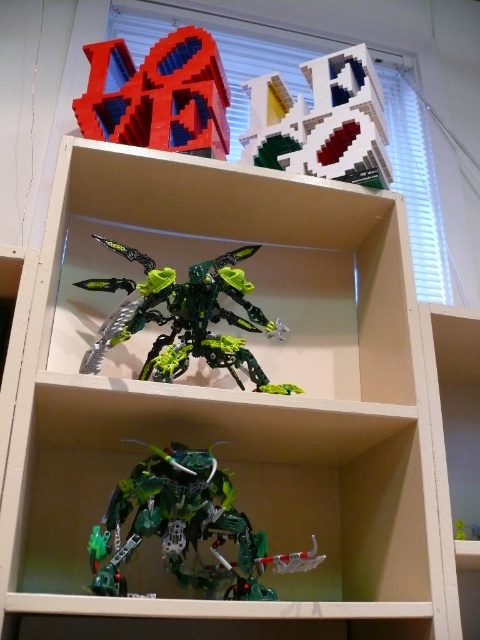
Question: Which of the following is the farthest from the observer?

Choices:
 (A) (180, 563)
 (B) (168, 115)

Answer: (B)

Question: Which point is closer to the camera taking this photo?

Choices:
 (A) (238, 314)
 (B) (374, 124)
 (C) (193, 572)
 (D) (181, 122)

Answer: (C)

Question: Can you confirm if translucent green plastic robot at center is thinner than white plastic blocks at upper center?

Choices:
 (A) no
 (B) yes

Answer: (A)

Question: Can you confirm if translucent green plastic robot at center is positioned to the right of brick-like plastic letters at upper center?

Choices:
 (A) no
 (B) yes

Answer: (B)

Question: Is translucent green plastic robot at center thinner than white plastic blocks at upper center?

Choices:
 (A) yes
 (B) no

Answer: (B)

Question: Among these objects, which one is nearest to the camera?

Choices:
 (A) translucent green plastic robot at center
 (B) white plastic blocks at upper center
 (C) green matte insect at center
 (D) brick-like plastic letters at upper center

Answer: (A)